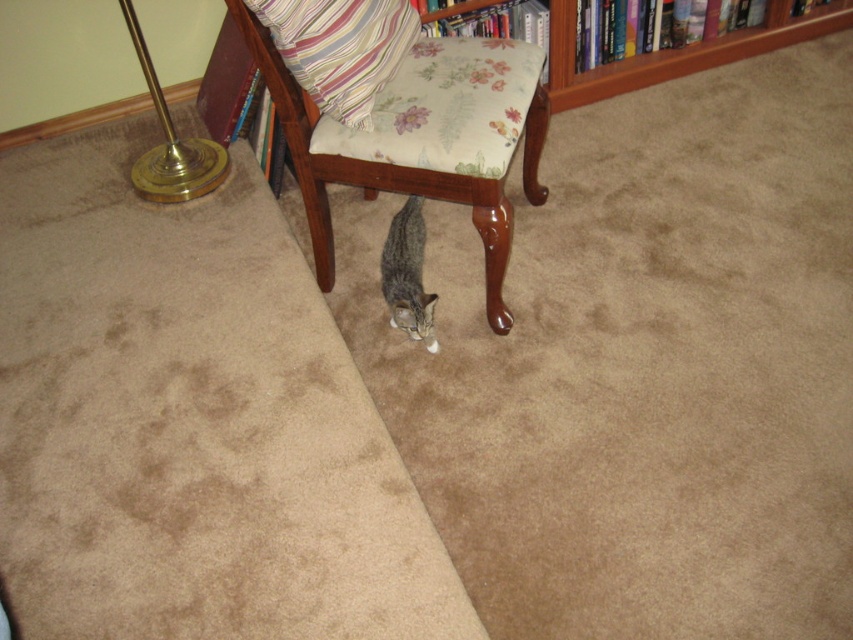
This screenshot has width=853, height=640. What do you see at coordinates (340, 49) in the screenshot?
I see `striped fabric pillow at upper center` at bounding box center [340, 49].

This screenshot has height=640, width=853. In order to click on striped fabric pillow at upper center in this screenshot , I will do `click(340, 49)`.

Looking at this image, who is more forward, (393,10) or (187,168)?

Point (393,10) is more forward.

This screenshot has height=640, width=853. I want to click on striped fabric pillow at upper center, so click(340, 49).

Between floral fabric chair at center and brass/metallic floor lamp at left, which one appears on the left side from the viewer's perspective?

From the viewer's perspective, brass/metallic floor lamp at left appears more on the left side.

Does floral fabric chair at center appear under brass/metallic floor lamp at left?

Indeed, floral fabric chair at center is positioned under brass/metallic floor lamp at left.

Does point (399, 113) come farther from viewer compared to point (131, 28)?

No, (399, 113) is in front of (131, 28).

Identify the location of floral fabric chair at center. Image resolution: width=853 pixels, height=640 pixels. tap(374, 176).

Which is above, floral fabric chair at center or striped fabric pillow at upper center?

striped fabric pillow at upper center

Is floral fabric chair at center closer to camera compared to striped fabric pillow at upper center?

That is False.

The image size is (853, 640). Identify the location of floral fabric chair at center. (374, 176).

Where is `floral fabric chair at center`? Image resolution: width=853 pixels, height=640 pixels. floral fabric chair at center is located at coordinates (374, 176).